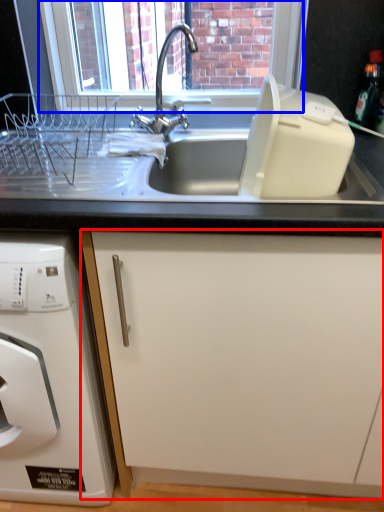
Question: Which object is closer to the camera taking this photo, cabinetry (highlighted by a red box) or window screen (highlighted by a blue box)?

Choices:
 (A) cabinetry
 (B) window screen

Answer: (A)